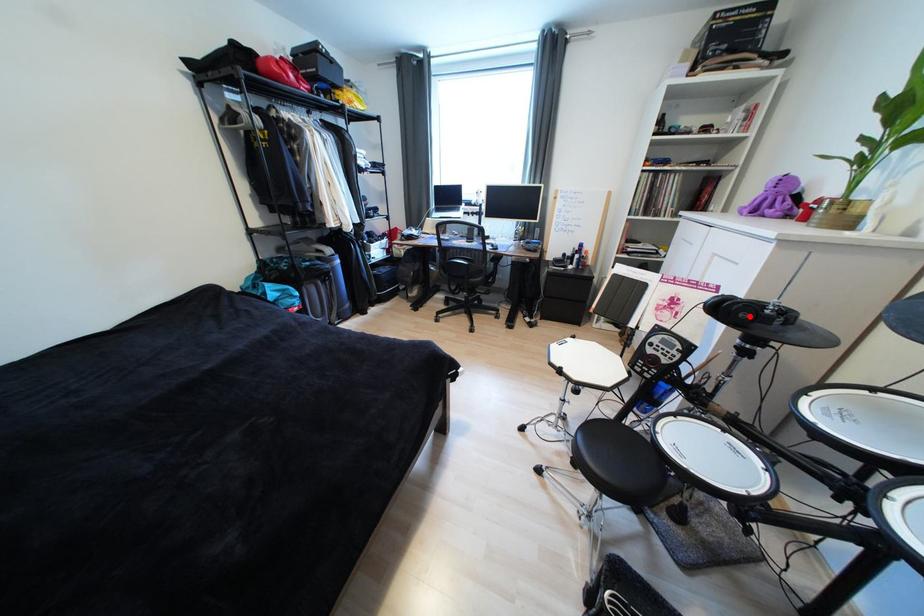
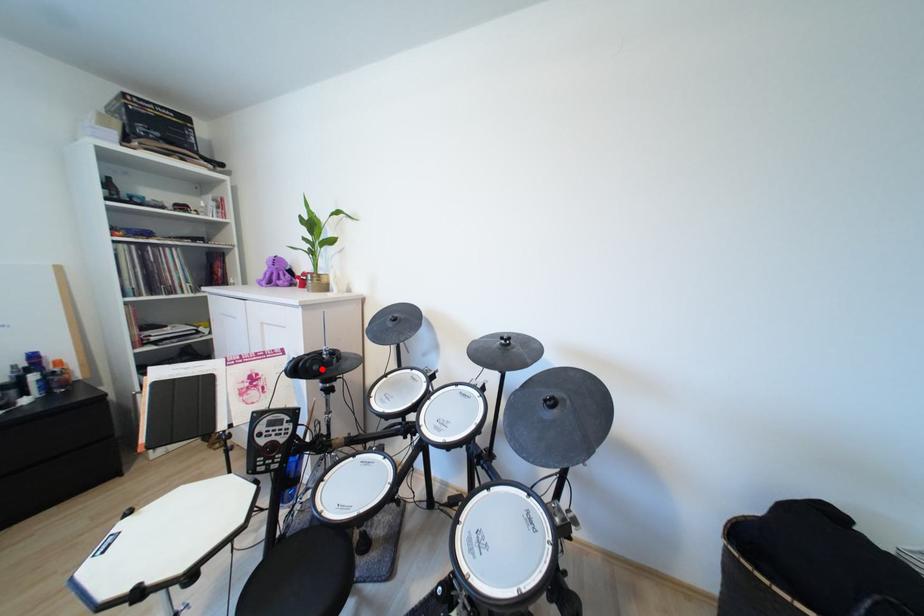
I am providing you with two images of the same scene from different viewpoints. A red point is marked on the first image and another point is marked on the second image. Is the marked point in image1 the same physical position as the marked point in image2?

Yes